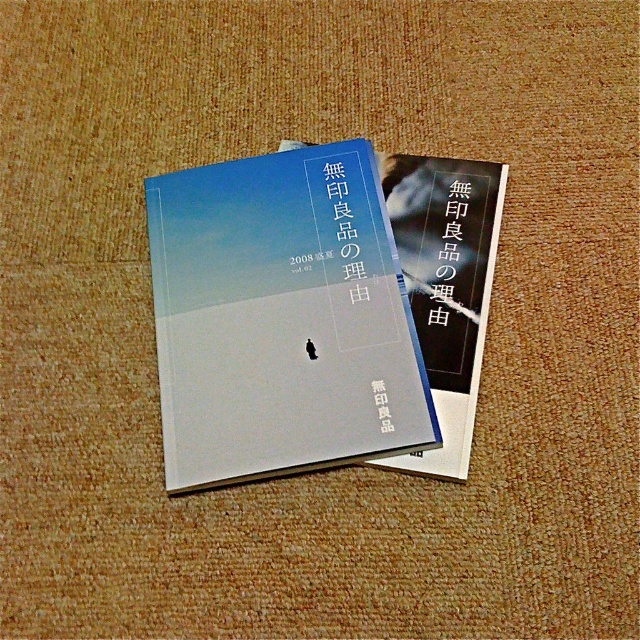
Question: Observing the image, what is the correct spatial positioning of matte paper book at center in reference to matte black book at center?

Choices:
 (A) above
 (B) below

Answer: (A)

Question: Where is matte paper book at center located in relation to matte black book at center in the image?

Choices:
 (A) left
 (B) right

Answer: (A)

Question: Which of the following is the closest to the observer?

Choices:
 (A) (440, 298)
 (B) (400, 362)

Answer: (B)

Question: Does matte paper book at center have a greater width compared to matte black book at center?

Choices:
 (A) yes
 (B) no

Answer: (A)

Question: Which point is closer to the camera?

Choices:
 (A) (474, 193)
 (B) (416, 372)

Answer: (B)